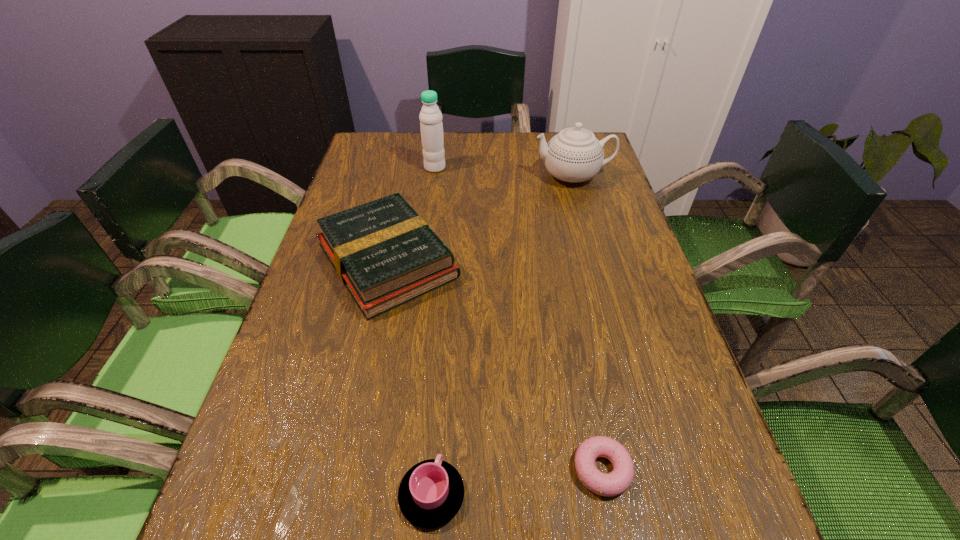
You are a GUI agent. You are given a task and a screenshot of the screen. Output one action in this format:
    pyautogui.click(x=<x>, y=<y>)
    Task: Click on the vacant space situated on the back of the hardback book
    The image size is (960, 540).
    Given the screenshot: What is the action you would take?
    pyautogui.click(x=413, y=143)

This screenshot has height=540, width=960. Identify the location of vacant space situated on the side with the handle of the cup. (439, 395).

The width and height of the screenshot is (960, 540). Identify the location of vacant space located 0.330m on the side with the handle of the cup. (445, 307).

At what (x,y) coordinates should I click in order to perform the action: click on vacant space situated 0.390m on the side with the handle of the cup. Please return your answer as a coordinate pair (x, y). This screenshot has height=540, width=960. Looking at the image, I should click on (447, 286).

Image resolution: width=960 pixels, height=540 pixels. Find the location of `blank space located 0.230m on the left of the shortest object`. blank space located 0.230m on the left of the shortest object is located at coordinates (427, 469).

Identify the location of water bottle at the far edge. This screenshot has width=960, height=540. (430, 117).

Locate an element on the screen. The width and height of the screenshot is (960, 540). chinaware present at the far edge is located at coordinates (574, 155).

Where is `object that is positioned at the left edge`? The image size is (960, 540). object that is positioned at the left edge is located at coordinates (385, 254).

Where is `chinaware present at the right edge`? The width and height of the screenshot is (960, 540). chinaware present at the right edge is located at coordinates (574, 155).

Where is `doughnut situated at the right edge`? The image size is (960, 540). doughnut situated at the right edge is located at coordinates (616, 482).